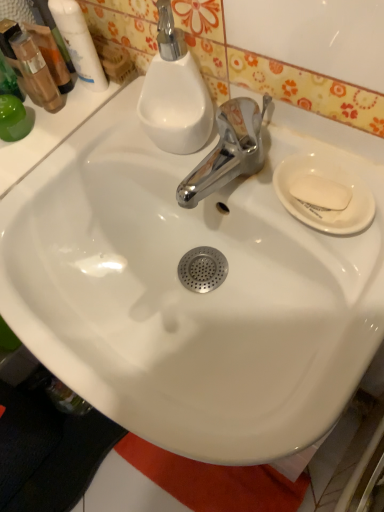
Locate an element on the screen. This screenshot has width=384, height=512. vacant space behind white matte soap at right is located at coordinates [x=263, y=148].